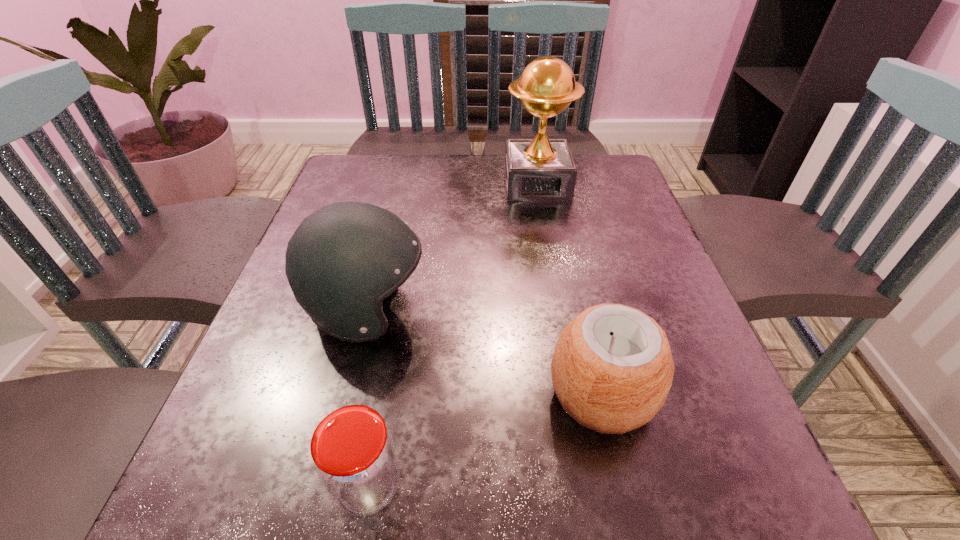
Locate an element on the screen. The height and width of the screenshot is (540, 960). object located at the far edge is located at coordinates (541, 169).

Locate an element on the screen. The image size is (960, 540). object present at the near edge is located at coordinates (354, 456).

The width and height of the screenshot is (960, 540). In order to click on object that is at the left edge in this screenshot , I will do `click(343, 260)`.

Locate an element on the screen. award at the right edge is located at coordinates (541, 169).

Identify the location of coconut that is at the right edge. The width and height of the screenshot is (960, 540). (612, 368).

At what (x,y) coordinates should I click in order to perform the action: click on object located at the far right corner. Please return your answer as a coordinate pair (x, y). The image size is (960, 540). Looking at the image, I should click on (541, 169).

The image size is (960, 540). Identify the location of blank area at the far edge. (410, 184).

Image resolution: width=960 pixels, height=540 pixels. I want to click on vacant space at the near edge of the desktop, so click(x=436, y=482).

In the image, there is a desktop. Where is `vacant space at the left edge`? The width and height of the screenshot is (960, 540). vacant space at the left edge is located at coordinates (304, 325).

This screenshot has height=540, width=960. What are the coordinates of `free region at the right edge of the desktop` in the screenshot? It's located at (649, 248).